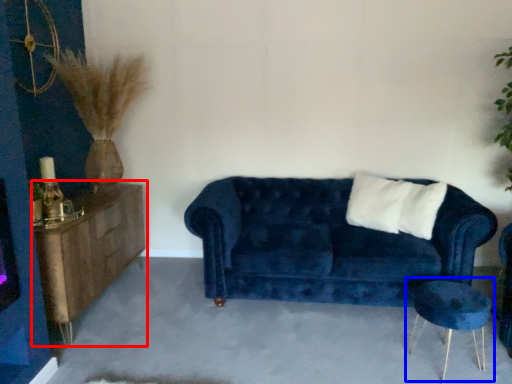
Question: Among these objects, which one is farthest to the camera, dresser (highlighted by a red box) or side table (highlighted by a blue box)?

Choices:
 (A) dresser
 (B) side table

Answer: (A)